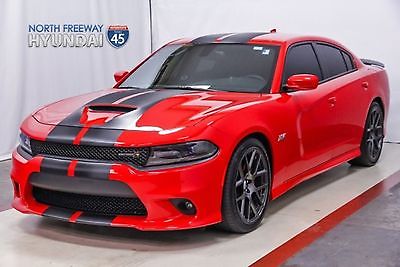
Locate an element on the screen. curtain is located at coordinates (49, 81).